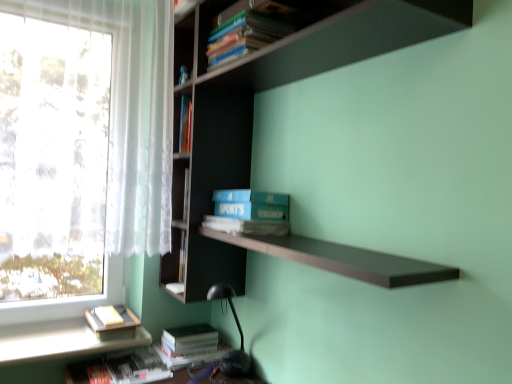
Question: From the image's perspective, is hardcover book at lower left, which is the 5th book from top to bottom, positioned above or below hardcover books at upper center, positioned as the fifth book in bottom-to-top order?

Choices:
 (A) above
 (B) below

Answer: (B)

Question: Is hardcover book at lower left, which is the 5th book from top to bottom, wider or thinner than hardcover books at upper center, positioned as the fifth book in bottom-to-top order?

Choices:
 (A) wide
 (B) thin

Answer: (A)

Question: Which is nearer to the hardcover book at lower left, the fourth book from the top?

Choices:
 (A) hardcover book at lower left, the third book in the top-to-bottom sequence
 (B) white matte window sill at lower left
 (C) dark wood bookcase at upper center
 (D) hardcover books at upper center, marked as the first book in a top-to-bottom arrangement
 (E) hardcover book at lower left, which appears as the 1th book when ordered from the bottom

Answer: (E)

Question: Estimate the real-world distances between objects in this image. Which object is closer to the hardcover books at upper center, marked as the first book in a top-to-bottom arrangement?

Choices:
 (A) hardcover book at lower left, which appears as the 1th book when ordered from the bottom
 (B) dark wood bookcase at upper center
 (C) blue matte sports book at center
 (D) white matte window sill at lower left
 (E) hardcover book at lower left, the fourth book from the top

Answer: (B)